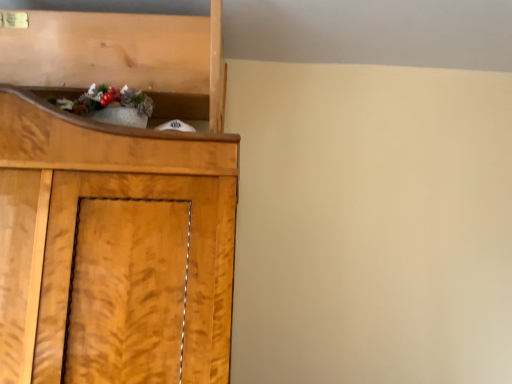
Where is `shiny metallic ornament at upper left`? shiny metallic ornament at upper left is located at coordinates (110, 105).

What is the approximate height of shiny metallic ornament at upper left?

7.12 inches.

Describe the element at coordinates (110, 105) in the screenshot. I see `shiny metallic ornament at upper left` at that location.

The image size is (512, 384). What do you see at coordinates (124, 57) in the screenshot? I see `wooden shelf at upper left` at bounding box center [124, 57].

Measure the distance between wooden shelf at upper left and camera.

The depth of wooden shelf at upper left is 4.72 feet.

From the picture: Measure the distance between point (81, 35) and camera.

The depth of point (81, 35) is 1.46 meters.

I want to click on wooden shelf at upper left, so click(124, 57).

I want to click on shiny metallic ornament at upper left, so click(110, 105).

Does wooden shelf at upper left appear on the left side of shiny metallic ornament at upper left?

Indeed, wooden shelf at upper left is positioned on the left side of shiny metallic ornament at upper left.

Is wooden shelf at upper left further to the viewer compared to shiny metallic ornament at upper left?

Yes, it is.

Is point (99, 62) more distant than point (74, 111)?

Yes, it is.

From the image's perspective, between wooden shelf at upper left and shiny metallic ornament at upper left, which one is located above?

wooden shelf at upper left, from the image's perspective.

Based on the photo, from a real-world perspective, is wooden shelf at upper left located higher than shiny metallic ornament at upper left?

Correct, in the physical world, wooden shelf at upper left is higher than shiny metallic ornament at upper left.

Which object is wider, wooden shelf at upper left or shiny metallic ornament at upper left?

wooden shelf at upper left is wider.

Looking at this image, considering the sizes of objects wooden shelf at upper left and shiny metallic ornament at upper left in the image provided, who is taller, wooden shelf at upper left or shiny metallic ornament at upper left?

wooden shelf at upper left is taller.

From the picture: Between wooden shelf at upper left and shiny metallic ornament at upper left, which one has smaller size?

Smaller between the two is shiny metallic ornament at upper left.

Is wooden shelf at upper left positioned beyond the bounds of shiny metallic ornament at upper left?

Indeed, wooden shelf at upper left is completely outside shiny metallic ornament at upper left.

Is wooden shelf at upper left with shiny metallic ornament at upper left?

No.

Is wooden shelf at upper left oriented towards shiny metallic ornament at upper left?

Yes.

What's the angular difference between wooden shelf at upper left and shiny metallic ornament at upper left's facing directions?

The facing directions of wooden shelf at upper left and shiny metallic ornament at upper left are 5.64 degrees apart.

Measure the distance between wooden shelf at upper left and shiny metallic ornament at upper left.

wooden shelf at upper left is 18.09 centimeters away from shiny metallic ornament at upper left.

The height and width of the screenshot is (384, 512). In order to click on shelf above the shiny metallic ornament at upper left (from a real-world perspective) in this screenshot , I will do `click(124, 57)`.

Visually, is shiny metallic ornament at upper left positioned to the left or to the right of wooden shelf at upper left?

From the image, it's evident that shiny metallic ornament at upper left is to the right of wooden shelf at upper left.

Does shiny metallic ornament at upper left come behind wooden shelf at upper left?

No, the depth of shiny metallic ornament at upper left is less than that of wooden shelf at upper left.

Does point (127, 98) come behind point (182, 45)?

No, (127, 98) is closer to viewer.

From the image's perspective, is shiny metallic ornament at upper left above wooden shelf at upper left?

No, from the image's perspective, shiny metallic ornament at upper left is not above wooden shelf at upper left.

In the scene shown: From a real-world perspective, is shiny metallic ornament at upper left physically located above or below wooden shelf at upper left?

From a real-world perspective, shiny metallic ornament at upper left is physically below wooden shelf at upper left.

Does shiny metallic ornament at upper left have a lesser width compared to wooden shelf at upper left?

Indeed, shiny metallic ornament at upper left has a lesser width compared to wooden shelf at upper left.

Which of these two, shiny metallic ornament at upper left or wooden shelf at upper left, stands taller?

wooden shelf at upper left.

Considering the sizes of shiny metallic ornament at upper left and wooden shelf at upper left in the image, is shiny metallic ornament at upper left bigger or smaller than wooden shelf at upper left?

In the image, shiny metallic ornament at upper left appears to be smaller than wooden shelf at upper left.

Which is correct: shiny metallic ornament at upper left is inside wooden shelf at upper left, or outside of it?

→ shiny metallic ornament at upper left fits inside wooden shelf at upper left.

Can you see shiny metallic ornament at upper left touching wooden shelf at upper left?

shiny metallic ornament at upper left and wooden shelf at upper left are clearly separated.

Is shiny metallic ornament at upper left turned away from wooden shelf at upper left?

Yes, shiny metallic ornament at upper left is facing away from wooden shelf at upper left.

How many degrees apart are the facing directions of shiny metallic ornament at upper left and wooden shelf at upper left?

shiny metallic ornament at upper left and wooden shelf at upper left are facing 5.64 degrees away from each other.

How far apart are shiny metallic ornament at upper left and wooden shelf at upper left?

7.12 inches.

Find the location of a particular element. The height and width of the screenshot is (384, 512). christmas decoration on the right of wooden shelf at upper left is located at coordinates (110, 105).

Locate an element on the screen. This screenshot has height=384, width=512. christmas decoration below the wooden shelf at upper left (from the image's perspective) is located at coordinates (110, 105).

This screenshot has height=384, width=512. In the image, there is a wooden shelf at upper left. Identify the location of christmas decoration below it (from a real-world perspective). (110, 105).